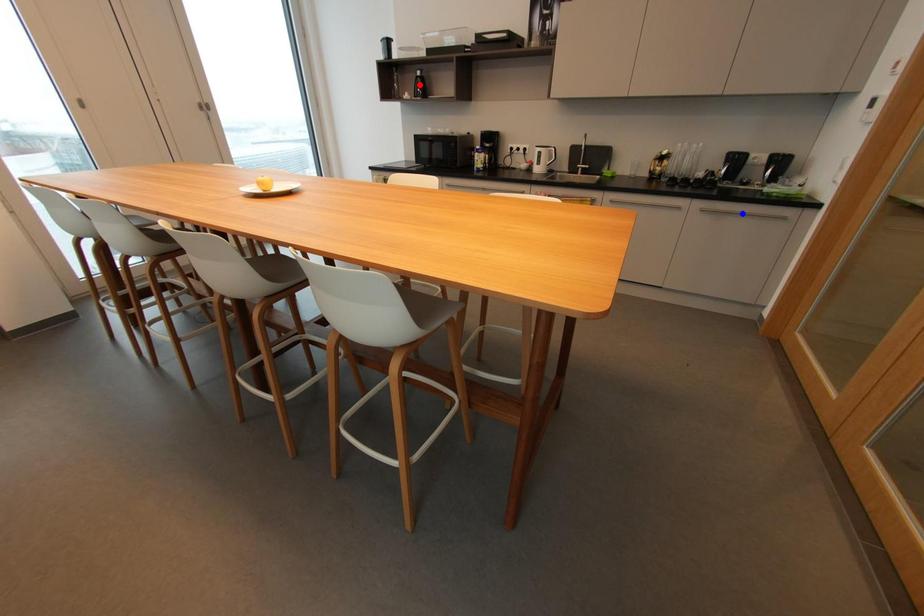
Question: Two points are marked on the image. Which point is closer to the camera?

Choices:
 (A) Blue point is closer.
 (B) Red point is closer.

Answer: (A)